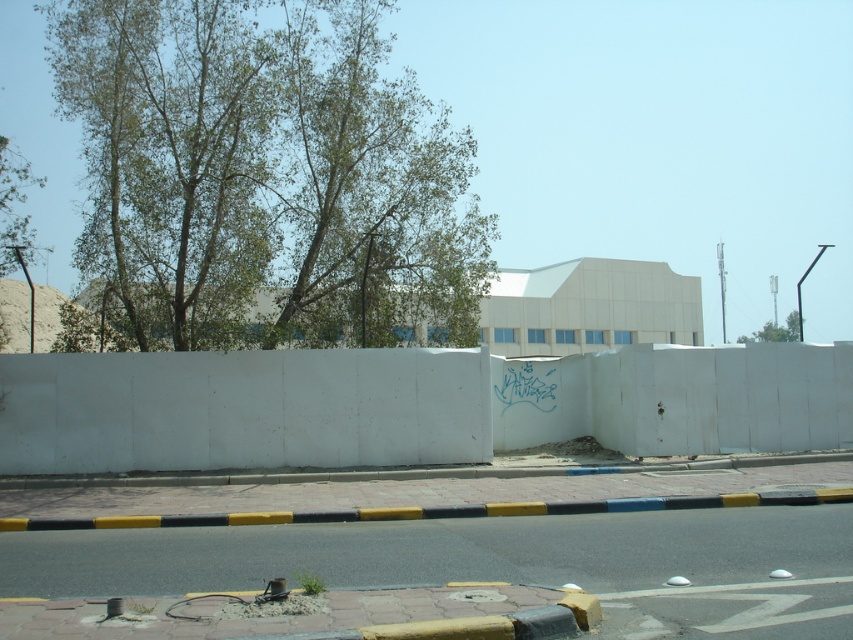
Does point (465, 392) lie in front of point (604, 500)?

No.

Is white concrete wall at center to the left of yellow-black striped curb at lower center from the viewer's perspective?

In fact, white concrete wall at center is to the right of yellow-black striped curb at lower center.

Is point (126, 416) positioned before point (465, 515)?

That is False.

At what (x,y) coordinates should I click in order to perform the action: click on white concrete wall at center. Please return your answer as a coordinate pair (x, y). This screenshot has height=640, width=853. Looking at the image, I should click on (410, 404).

Looking at this image, is green leafy tree at upper left wider than white concrete wall at center?

Indeed, green leafy tree at upper left has a greater width compared to white concrete wall at center.

Between point (94, 253) and point (653, 380), which one is positioned behind?

The point (94, 253) is behind.

Between point (344, 170) and point (460, 442), which one is positioned in front?

Point (460, 442) is in front.

Locate an element on the screen. green leafy tree at upper left is located at coordinates (265, 177).

Is green leafy tree at upper left positioned before green leafy tree at upper right?

Yes, it is in front of green leafy tree at upper right.

Who is higher up, green leafy tree at upper left or green leafy tree at upper right?

green leafy tree at upper left

What do you see at coordinates (265, 177) in the screenshot? The image size is (853, 640). I see `green leafy tree at upper left` at bounding box center [265, 177].

You are a GUI agent. You are given a task and a screenshot of the screen. Output one action in this format:
    pyautogui.click(x=<x>, y=<y>)
    Task: Click on the green leafy tree at upper left
    
    Given the screenshot: What is the action you would take?
    pyautogui.click(x=265, y=177)